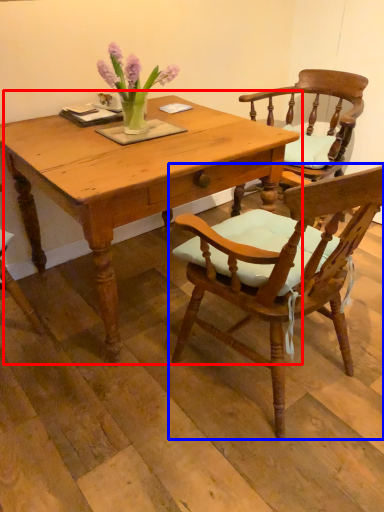
Question: Which point is closer to the camera, table (highlighted by a red box) or chair (highlighted by a blue box)?

Choices:
 (A) table
 (B) chair

Answer: (B)